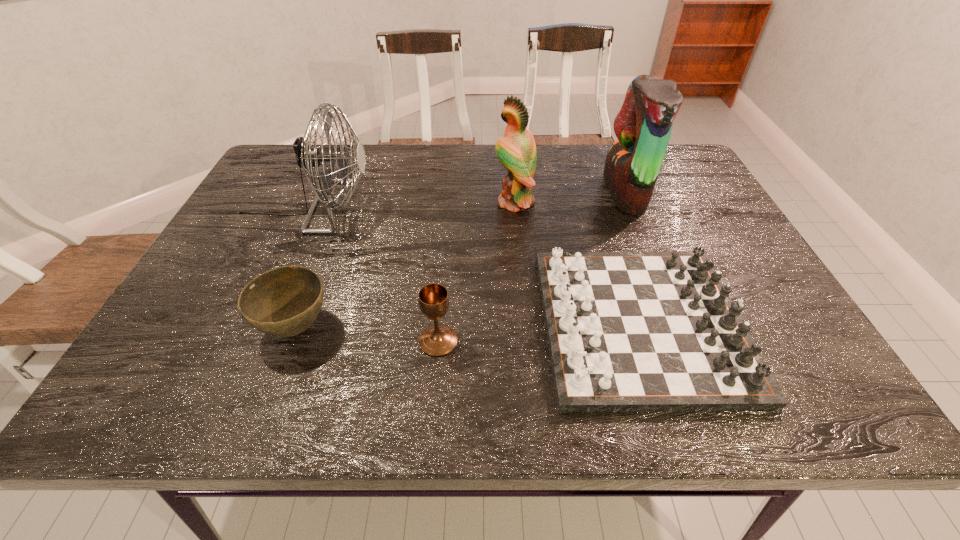
Locate an element on the screen. This screenshot has width=960, height=540. blank region between the fan and the right parrot is located at coordinates (467, 199).

The height and width of the screenshot is (540, 960). What are the coordinates of `free space between the fan and the fourth object from right to left` in the screenshot? It's located at (372, 274).

This screenshot has width=960, height=540. Find the location of `blank region between the chessboard and the fourth tallest object`. blank region between the chessboard and the fourth tallest object is located at coordinates (540, 332).

This screenshot has width=960, height=540. What are the coordinates of `free space between the bowl and the left parrot` in the screenshot? It's located at (405, 265).

The height and width of the screenshot is (540, 960). I want to click on vacant area that lies between the right parrot and the fan, so click(467, 199).

The image size is (960, 540). Identify the location of vacant point located between the bowl and the chalice. (367, 334).

The image size is (960, 540). Identify the location of vacant area that lies between the chalice and the chessboard. (540, 332).

Identify the location of empty location between the fourth object from right to left and the right parrot. (532, 267).

Identify which object is the fifth closest to the third shortest object. Please provide its 2D coordinates. Your answer should be formatted as a tuple, i.e. [(x, y)], where the tuple contains the x and y coordinates of a point satisfying the conditions above.

[(643, 126)]

Find the location of a particular element. The image size is (960, 540). object identified as the third closest to the right parrot is located at coordinates (438, 340).